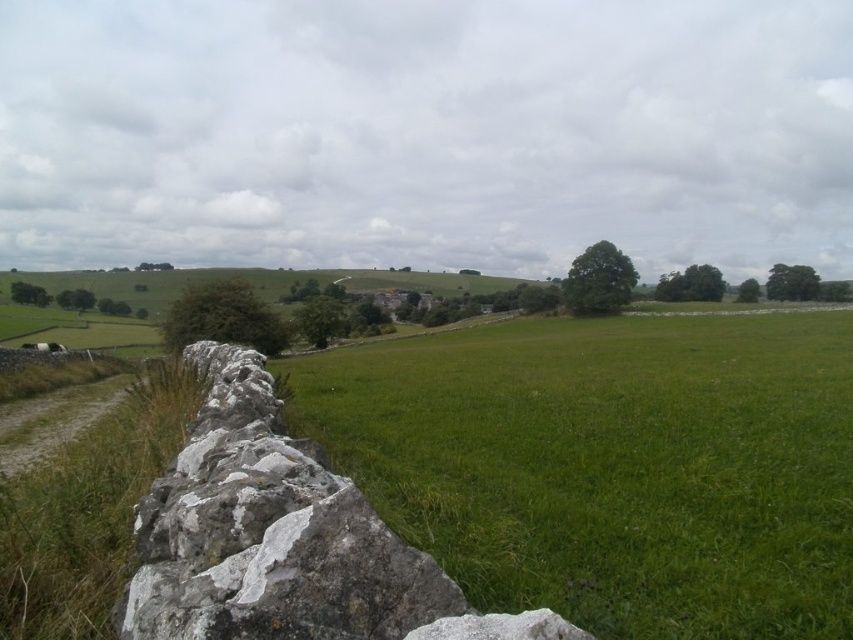
Between point (695, 397) and point (405, 545), which one is positioned in front?

Point (405, 545) is more forward.

Which is below, green grassy field at center or white rough stone at left?

green grassy field at center is lower down.

Between point (616, 468) and point (244, 444), which one is positioned in front?

Positioned in front is point (244, 444).

At what (x,y) coordinates should I click in order to perform the action: click on green grassy field at center. Please return your answer as a coordinate pair (x, y). Looking at the image, I should click on (610, 465).